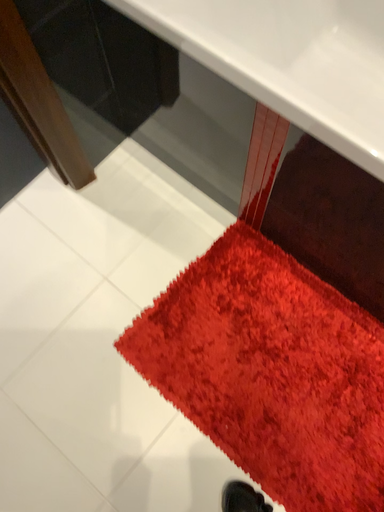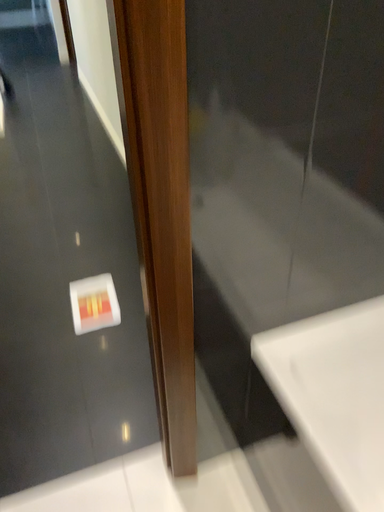
Question: Which way did the camera rotate in the video?

Choices:
 (A) rotated downward
 (B) rotated upward

Answer: (B)